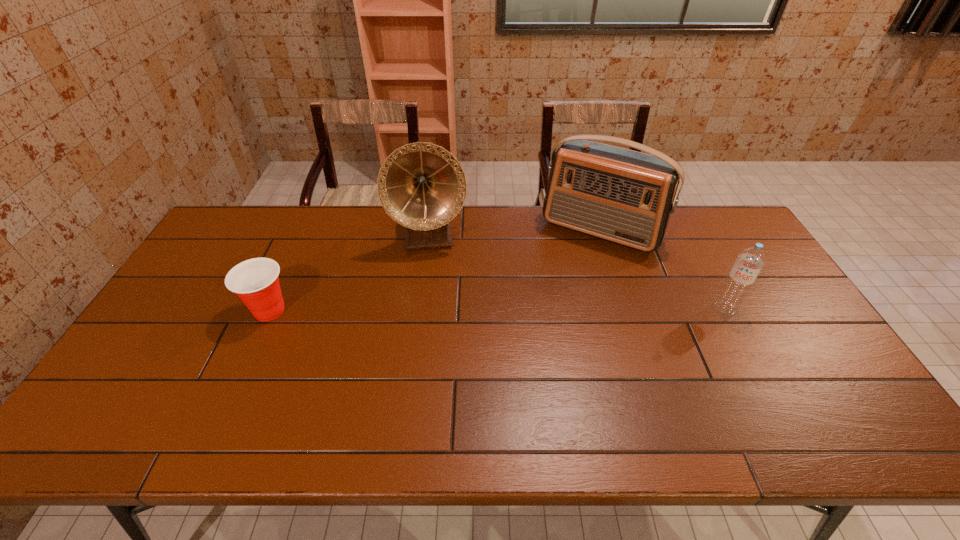
Identify the location of free area in between the second object from left to right and the third tallest object. Image resolution: width=960 pixels, height=540 pixels. pos(577,272).

This screenshot has width=960, height=540. I want to click on free space between the second object from left to right and the rightmost object, so click(x=577, y=272).

Locate an element on the screen. This screenshot has height=540, width=960. empty space between the second object from left to right and the cup is located at coordinates (350, 273).

Point out which object is positioned as the second nearest to the leftmost object. Please provide its 2D coordinates. Your answer should be formatted as a tuple, i.e. [(x, y)], where the tuple contains the x and y coordinates of a point satisfying the conditions above.

[(620, 195)]

The height and width of the screenshot is (540, 960). I want to click on object that stands as the third closest to the third object from right to left, so click(751, 260).

Where is `vacant space that satisfies the following two spatial constraints: 1. on the front side of the radio receiver; 2. on the right side of the third tallest object`? Image resolution: width=960 pixels, height=540 pixels. vacant space that satisfies the following two spatial constraints: 1. on the front side of the radio receiver; 2. on the right side of the third tallest object is located at coordinates (626, 308).

At what (x,y) coordinates should I click in order to perform the action: click on free space in the image that satisfies the following two spatial constraints: 1. on the front side of the phonograph record; 2. on the right side of the third tallest object. Please return your answer as a coordinate pair (x, y). The image size is (960, 540). Looking at the image, I should click on (420, 308).

Find the location of `free spot that satisfies the following two spatial constraints: 1. on the front side of the third object from right to left; 2. on the right side of the rightmost object`. free spot that satisfies the following two spatial constraints: 1. on the front side of the third object from right to left; 2. on the right side of the rightmost object is located at coordinates (420, 308).

This screenshot has height=540, width=960. I want to click on vacant space that satisfies the following two spatial constraints: 1. on the back side of the cup; 2. on the left side of the third tallest object, so click(x=271, y=308).